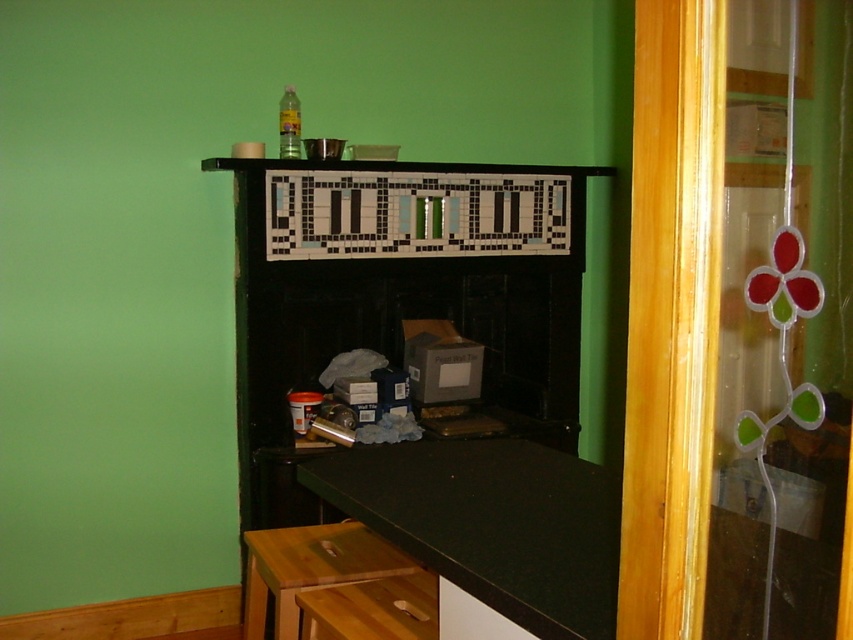
Is stained glass at right to the right of black laminate counter top at lower center from the viewer's perspective?

Correct, you'll find stained glass at right to the right of black laminate counter top at lower center.

You are a GUI agent. You are given a task and a screenshot of the screen. Output one action in this format:
    pyautogui.click(x=<x>, y=<y>)
    Task: Click on the stained glass at right
    Image resolution: width=853 pixels, height=640 pixels.
    Given the screenshot: What is the action you would take?
    pyautogui.click(x=782, y=323)

Locate an element on the screen. The height and width of the screenshot is (640, 853). stained glass at right is located at coordinates (782, 323).

Who is lower down, wooden stool at lower center or white matte drawer at lower center?

Positioned lower is wooden stool at lower center.

Can you confirm if wooden stool at lower center is thinner than white matte drawer at lower center?

No.

Which is behind, point (253, 557) or point (497, 628)?

Positioned behind is point (253, 557).

Identify the location of wooden stool at lower center. Image resolution: width=853 pixels, height=640 pixels. (310, 568).

Can you confirm if stained glass at right is smaller than wooden stool at lower center?

Correct, stained glass at right occupies less space than wooden stool at lower center.

Who is more forward, (833, 211) or (277, 563)?

Point (833, 211)

Which is in front, point (741, 458) or point (289, 600)?

Point (741, 458) is more forward.

At what (x,y) coordinates should I click in order to perform the action: click on stained glass at right. Please return your answer as a coordinate pair (x, y). This screenshot has width=853, height=640. Looking at the image, I should click on (782, 323).